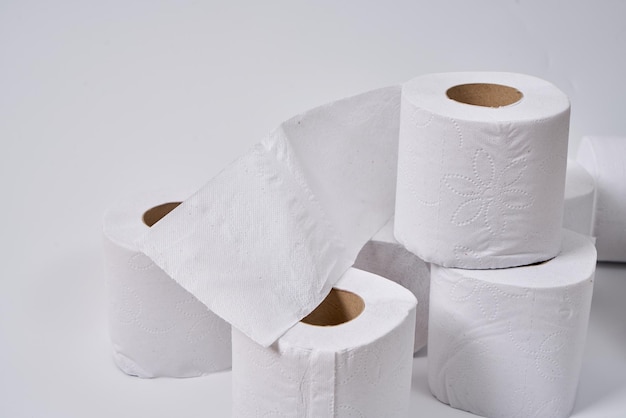
Find the location of a particular element. roll of toilet paper is located at coordinates (327, 364), (175, 344), (505, 181), (528, 315), (401, 250), (581, 201), (616, 188).